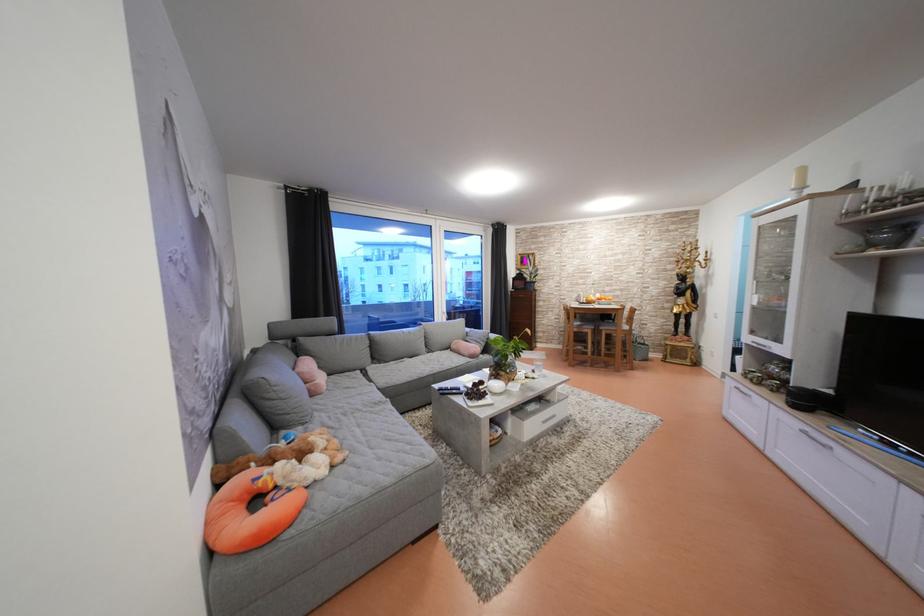
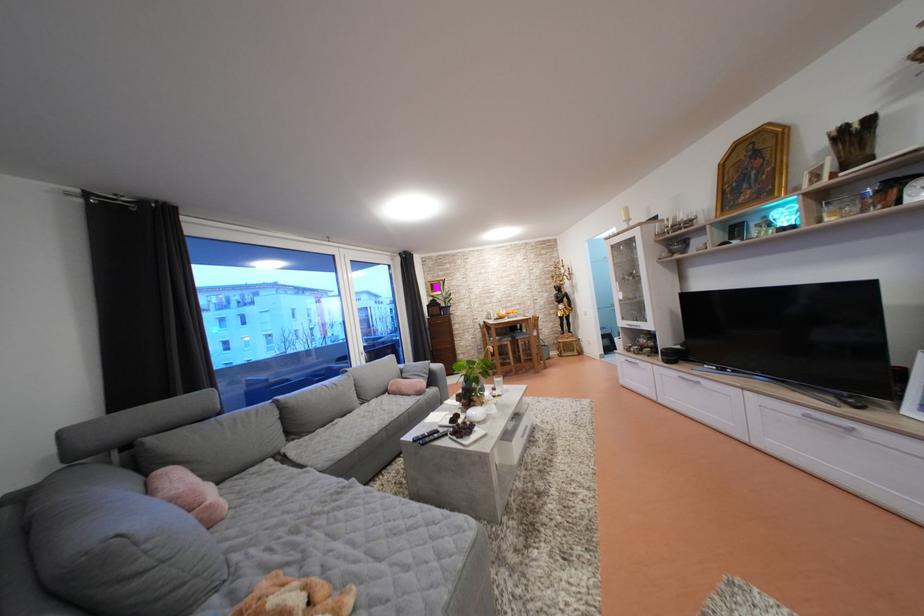
Where in the second image is the point corresponding to pixel 551 338 from the first image?

(470, 359)